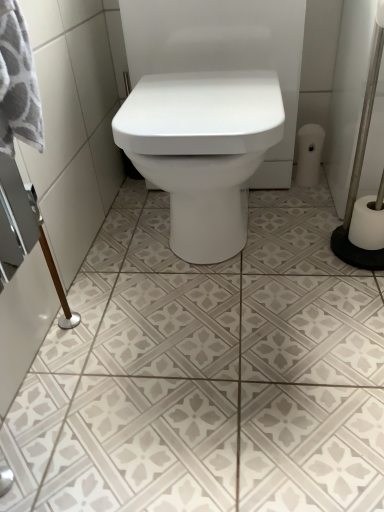
This screenshot has height=512, width=384. I want to click on free point above white textured tile at center (from a real-world perspective), so click(220, 296).